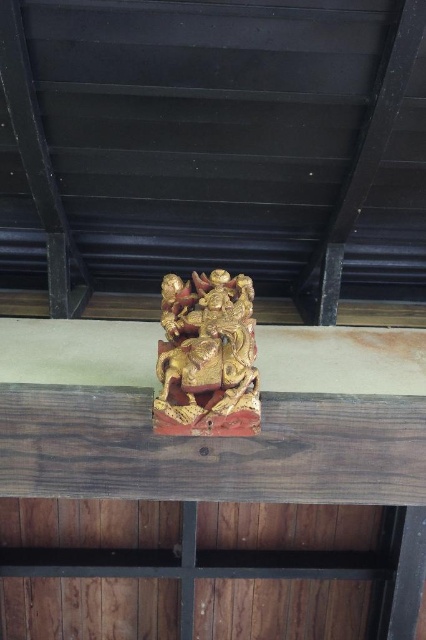
Is wooden beam at center to the right of gold polished wood carving at upper center from the viewer's perspective?

Correct, you'll find wooden beam at center to the right of gold polished wood carving at upper center.

Who is higher up, wooden beam at center or gold polished wood carving at upper center?

Positioned higher is gold polished wood carving at upper center.

Does point (111, 426) come farther from viewer compared to point (244, 316)?

Yes, point (111, 426) is farther from viewer.

You are a GUI agent. You are given a task and a screenshot of the screen. Output one action in this format:
    pyautogui.click(x=<x>, y=<y>)
    Task: Click on the wooden beam at center
    
    Given the screenshot: What is the action you would take?
    pyautogui.click(x=212, y=449)